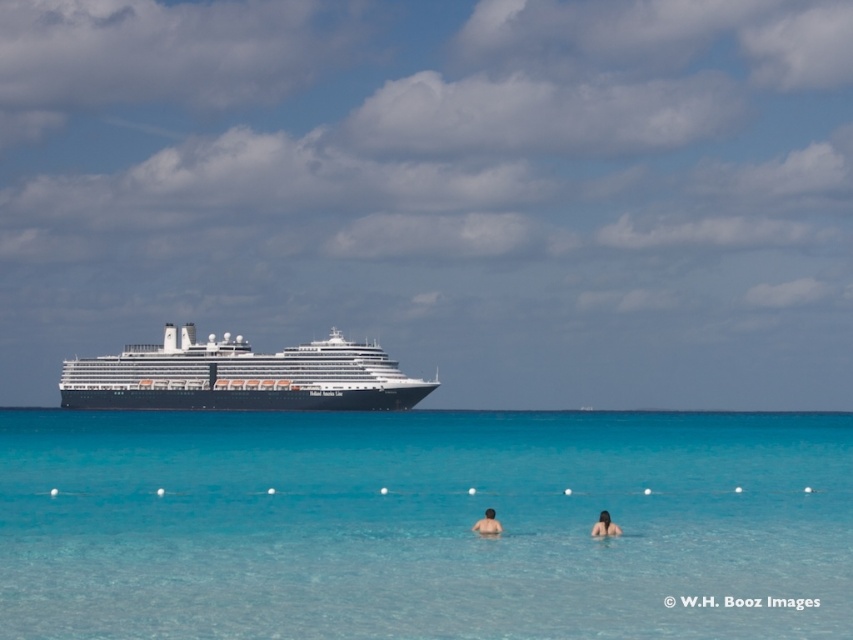
You are a photographer taking a picture of the clear blue water at center and the skinny man at center. Which object will appear larger in your photo?

The clear blue water at center will appear larger in the photo because it is bigger than the skinny man at center.

You are a photographer trying to capture a shot of the dark brown hair at lower center and the clear blue water at center. Which object should you focus on first if you want to include both in your frame without moving the camera?

You should focus on the dark brown hair at lower center first because it is closer to the camera than the clear blue water at center, allowing both to be in the frame without moving the camera.

You are a photographer on the beach and want to capture both the black glossy cruise ship at center and the skinny man at center in a single photo. Given their sizes, which object will appear bigger in the photo?

The black glossy cruise ship at center will appear bigger in the photo because it has a larger size compared to the skinny man at center.